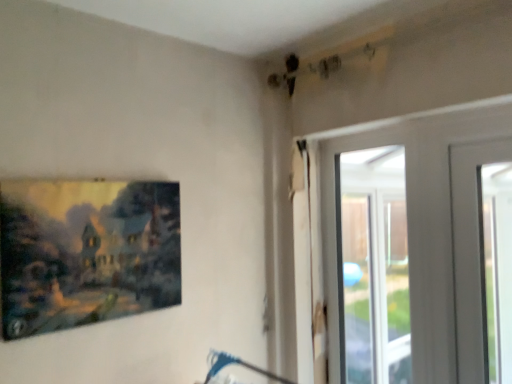
Question: Looking at their shapes, would you say transparent glass door at upper right is wider or thinner than matte canvas painting at left?

Choices:
 (A) thin
 (B) wide

Answer: (A)

Question: Is point (361, 307) closer or farther from the camera than point (54, 205)?

Choices:
 (A) closer
 (B) farther

Answer: (B)

Question: Visually, is transparent glass door at upper right positioned to the left or to the right of matte canvas painting at left?

Choices:
 (A) right
 (B) left

Answer: (A)

Question: From the image's perspective, is matte canvas painting at left above or below transparent glass door at upper right?

Choices:
 (A) below
 (B) above

Answer: (B)

Question: Is point (2, 233) closer or farther from the camera than point (354, 365)?

Choices:
 (A) closer
 (B) farther

Answer: (A)

Question: Considering the positions of matte canvas painting at left and transparent glass door at upper right in the image, is matte canvas painting at left wider or thinner than transparent glass door at upper right?

Choices:
 (A) wide
 (B) thin

Answer: (A)

Question: In the image, is matte canvas painting at left on the left side or the right side of transparent glass door at upper right?

Choices:
 (A) right
 (B) left

Answer: (B)